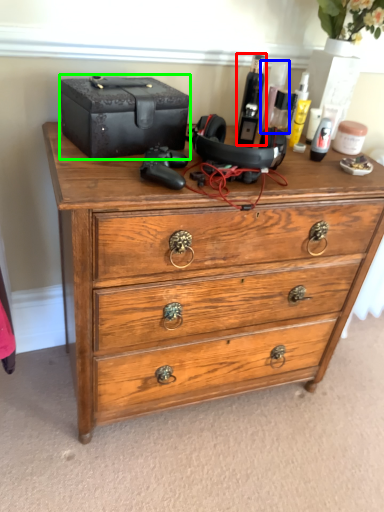
Question: Which object is the closest to the toiletry (highlighted by a red box)? Choose among these: toiletry (highlighted by a blue box) or storage box (highlighted by a green box).

Choices:
 (A) toiletry
 (B) storage box

Answer: (A)